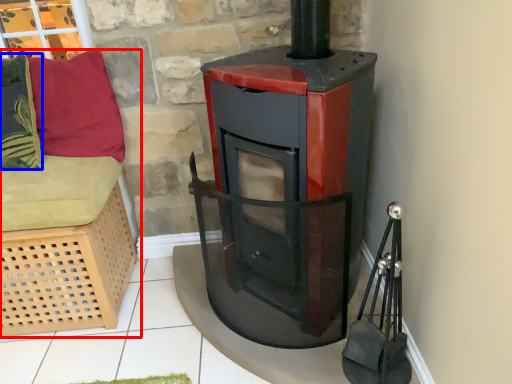
Question: Which object is closer to the camera taking this photo, furniture (highlighted by a red box) or pillow (highlighted by a blue box)?

Choices:
 (A) furniture
 (B) pillow

Answer: (A)